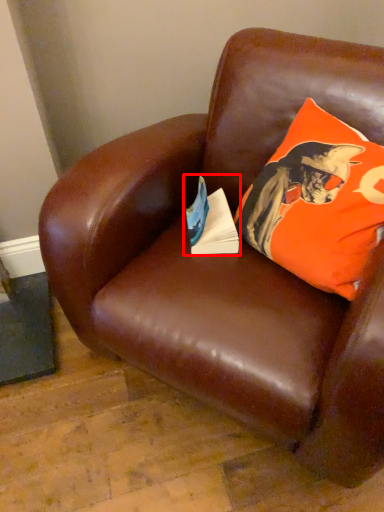
Question: From the image's perspective, what is the correct spatial positioning of paperback book (annotated by the red box) in reference to pillow?

Choices:
 (A) above
 (B) below

Answer: (B)